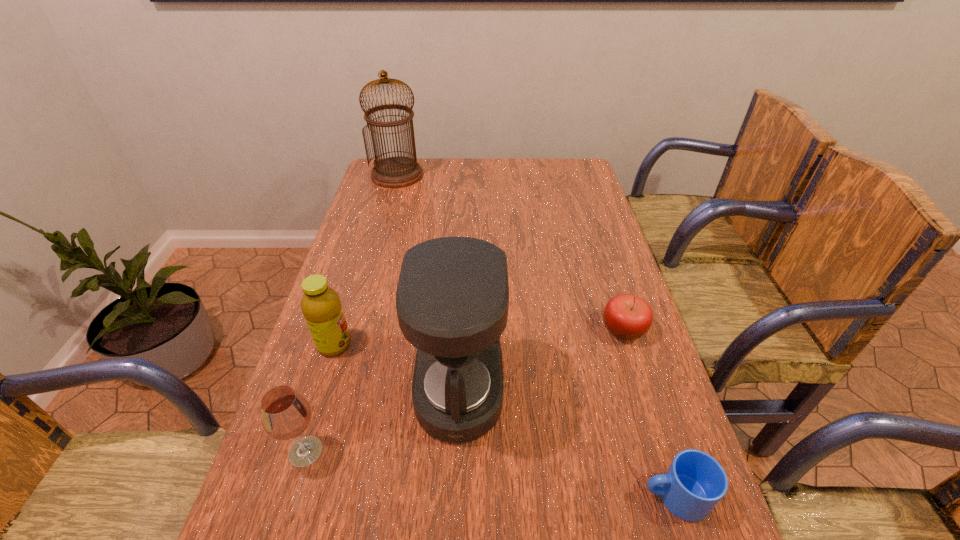
The height and width of the screenshot is (540, 960). Identify the location of vacant point located between the mug and the wineglass. (491, 474).

In order to click on vacant area between the fruit juice and the wineglass in this screenshot , I will do `click(320, 398)`.

Identify the location of the third closest object to the fruit juice. (626, 316).

Identify which object is located as the second nearest to the wineglass. Please provide its 2D coordinates. Your answer should be formatted as a tuple, i.e. [(x, y)], where the tuple contains the x and y coordinates of a point satisfying the conditions above.

[(321, 306)]

The width and height of the screenshot is (960, 540). Find the location of `vacant area in the image that satisfies the following two spatial constraints: 1. on the front label of the wineglass; 2. on the right side of the fruit juice`. vacant area in the image that satisfies the following two spatial constraints: 1. on the front label of the wineglass; 2. on the right side of the fruit juice is located at coordinates (301, 451).

Identify the location of vacant space that satisfies the following two spatial constraints: 1. on the front-facing side of the apple; 2. on the right side of the farthest object. (354, 330).

Where is `free space that satisfies the following two spatial constraints: 1. on the front label of the fruit juice; 2. on the right side of the wineglass`? The width and height of the screenshot is (960, 540). free space that satisfies the following two spatial constraints: 1. on the front label of the fruit juice; 2. on the right side of the wineglass is located at coordinates point(301,451).

You are a GUI agent. You are given a task and a screenshot of the screen. Output one action in this format:
    pyautogui.click(x=<x>, y=<y>)
    Task: Click on the free space that satisfies the following two spatial constraints: 1. on the front-facing side of the fifth tallest object; 2. on the left side of the birdcage
    This screenshot has width=960, height=540.
    Given the screenshot: What is the action you would take?
    pyautogui.click(x=354, y=330)

This screenshot has width=960, height=540. Find the location of `vacant space that satisfies the following two spatial constraints: 1. on the front-facing side of the birdcage; 2. on the right side of the fifth tallest object`. vacant space that satisfies the following two spatial constraints: 1. on the front-facing side of the birdcage; 2. on the right side of the fifth tallest object is located at coordinates pos(354,330).

In order to click on vacant point that satisfies the following two spatial constraints: 1. on the front-facing side of the farthest object; 2. on the right side of the second shortest object in this screenshot , I will do click(x=354, y=330).